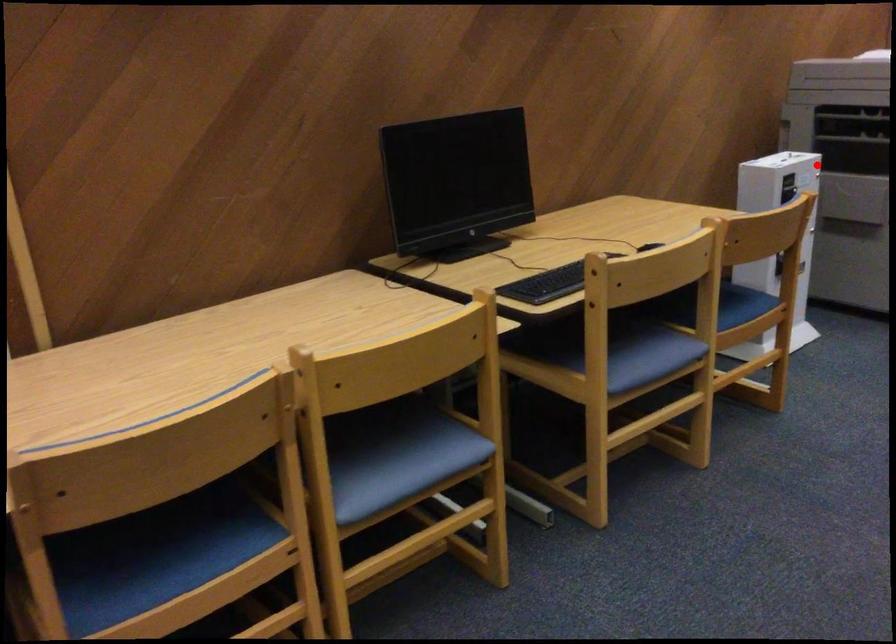
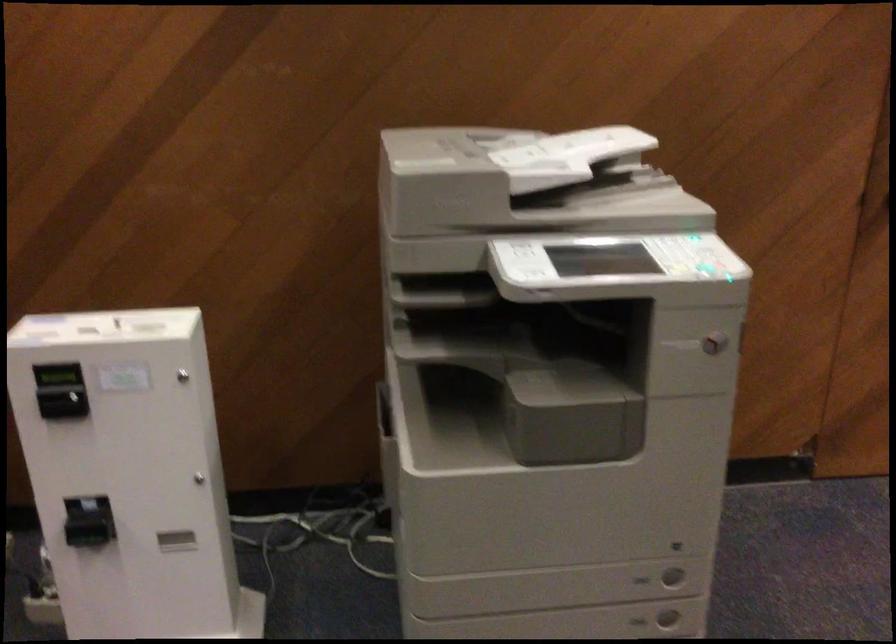
Where in the second image is the point corresponding to the highlighted location from the first image?

(183, 375)